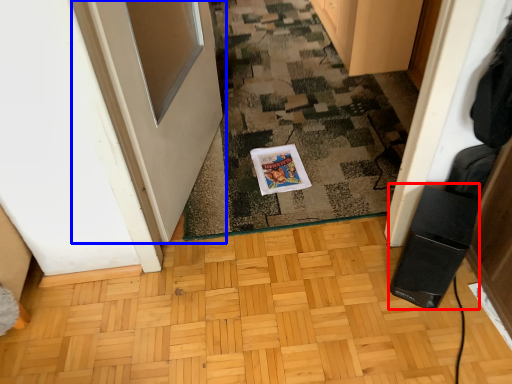
Question: Which of the following is the farthest to the observer, appliance (highlighted by a red box) or door (highlighted by a blue box)?

Choices:
 (A) appliance
 (B) door

Answer: (A)